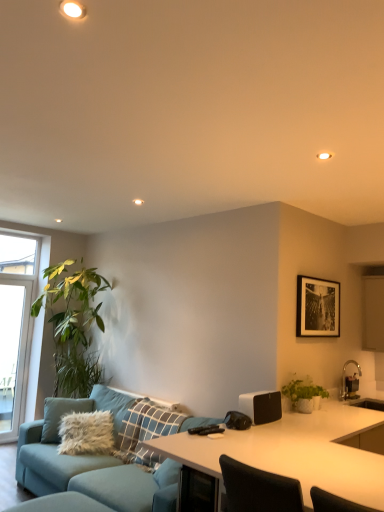
Question: Is light blue fabric swivel chair at lower left not within green matte plant at right?

Choices:
 (A) no
 (B) yes

Answer: (B)

Question: From the image's perspective, is light blue fabric swivel chair at lower left on green matte plant at right?

Choices:
 (A) no
 (B) yes

Answer: (A)

Question: Is light blue fabric swivel chair at lower left next to green matte plant at right?

Choices:
 (A) yes
 (B) no

Answer: (B)

Question: Can you confirm if light blue fabric swivel chair at lower left is bigger than green matte plant at right?

Choices:
 (A) yes
 (B) no

Answer: (A)

Question: Considering the relative sizes of light blue fabric swivel chair at lower left and green matte plant at right in the image provided, is light blue fabric swivel chair at lower left wider than green matte plant at right?

Choices:
 (A) yes
 (B) no

Answer: (A)

Question: Considering the relative sizes of light blue fabric swivel chair at lower left and green matte plant at right in the image provided, is light blue fabric swivel chair at lower left thinner than green matte plant at right?

Choices:
 (A) no
 (B) yes

Answer: (A)

Question: Is transparent glass window at left completely or partially outside of teal fabric couch at center?

Choices:
 (A) yes
 (B) no

Answer: (A)

Question: Is transparent glass window at left bigger than teal fabric couch at center?

Choices:
 (A) yes
 (B) no

Answer: (B)

Question: From a real-world perspective, is transparent glass window at left physically above teal fabric couch at center?

Choices:
 (A) no
 (B) yes

Answer: (B)

Question: Considering the relative positions of transparent glass window at left and teal fabric couch at center in the image provided, is transparent glass window at left to the right of teal fabric couch at center from the viewer's perspective?

Choices:
 (A) no
 (B) yes

Answer: (A)

Question: From the image's perspective, would you say transparent glass window at left is positioned over teal fabric couch at center?

Choices:
 (A) yes
 (B) no

Answer: (A)

Question: Does transparent glass window at left lie behind teal fabric couch at center?

Choices:
 (A) no
 (B) yes

Answer: (B)

Question: From a real-world perspective, is teal fabric couch at center below white glossy desk at center?

Choices:
 (A) yes
 (B) no

Answer: (A)